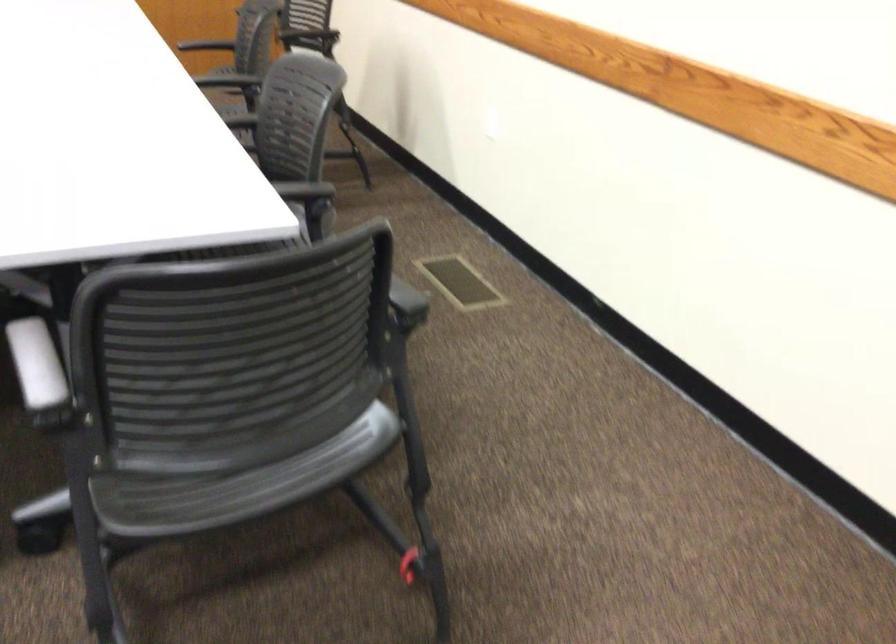
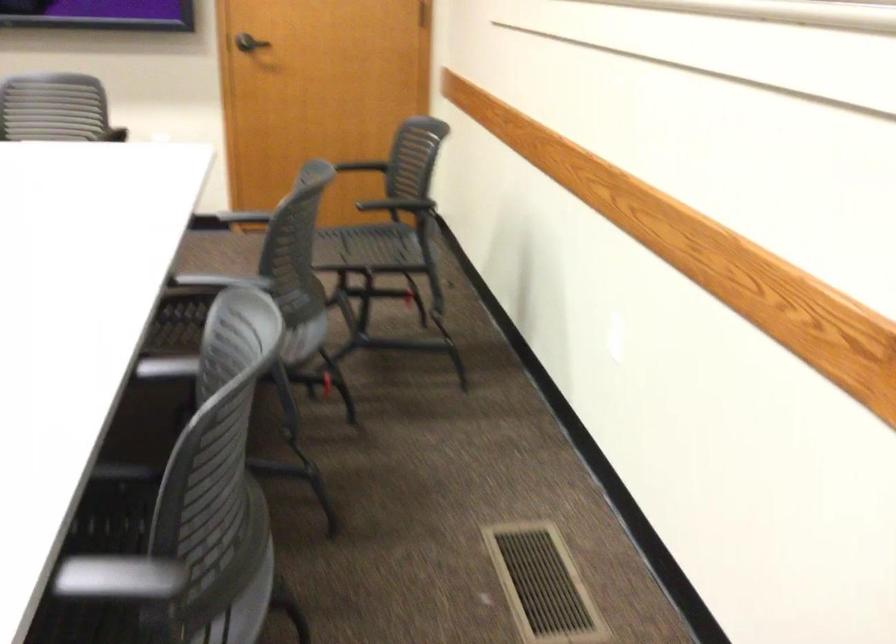
Question: The images are taken continuously from a first-person perspective. In which direction are you moving?

Choices:
 (A) Left
 (B) Right
 (C) Forward
 (D) Backward

Answer: (C)